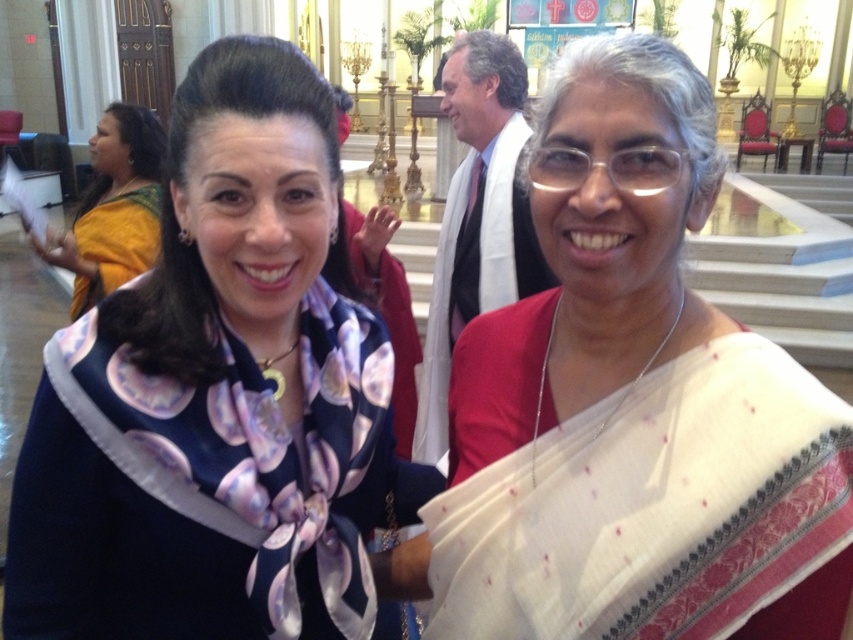
Can you confirm if white silk saree at center is shorter than yellow silk saree at left?

Yes.

Is point (720, 312) in front of point (129, 164)?

Yes, it is.

At what (x,y) coordinates should I click in order to perform the action: click on white silk saree at center. Please return your answer as a coordinate pair (x, y). Looking at the image, I should click on (631, 401).

Who is more forward, (x=131, y=372) or (x=146, y=172)?

Point (x=131, y=372) is more forward.

Does silky floral scarf at center appear over yellow silk saree at left?

No, silky floral scarf at center is not above yellow silk saree at left.

Is point (125, 456) closer to camera compared to point (109, 140)?

Yes, point (125, 456) is in front of point (109, 140).

Find the location of `silky floral scarf at center`. silky floral scarf at center is located at coordinates (218, 397).

Is silky floral scarf at center below white silk saree at center?

Incorrect, silky floral scarf at center is not positioned below white silk saree at center.

Does point (93, 598) come behind point (630, 609)?

That is True.

Find the location of a particular element. silky floral scarf at center is located at coordinates (218, 397).